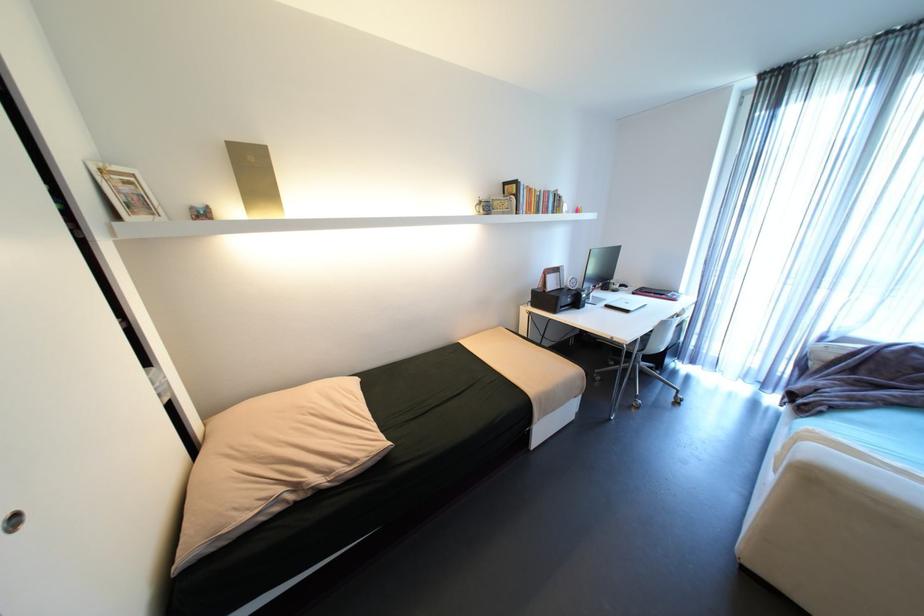
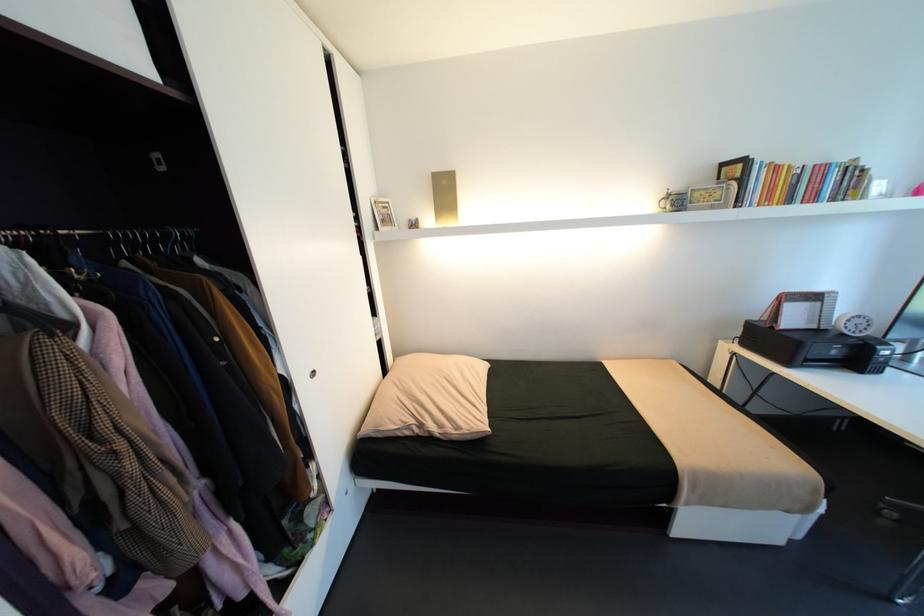
Question: The camera is either moving clockwise (left) or counter-clockwise (right) around the object. The first image is from the beginning of the video and the second image is from the end. Is the camera moving left or right when shooting the video?

Choices:
 (A) Left
 (B) Right

Answer: (B)